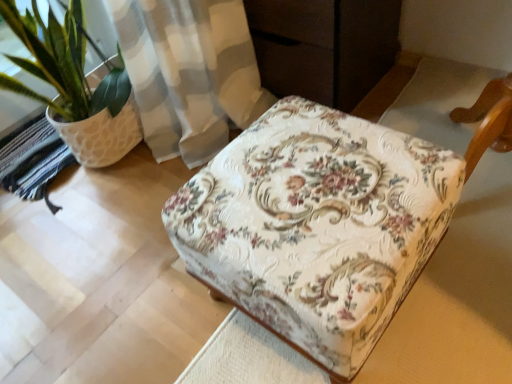
Question: Should I look upward or downward to see floral fabric ottoman at center?

Choices:
 (A) up
 (B) down

Answer: (B)

Question: Does floral fabric ottoman at center have a greater width compared to green leafy plant in textured pot at left?

Choices:
 (A) no
 (B) yes

Answer: (B)

Question: Is floral fabric ottoman at center to the right of green leafy plant in textured pot at left from the viewer's perspective?

Choices:
 (A) yes
 (B) no

Answer: (A)

Question: Can you confirm if floral fabric ottoman at center is shorter than green leafy plant in textured pot at left?

Choices:
 (A) no
 (B) yes

Answer: (B)

Question: Considering the relative sizes of floral fabric ottoman at center and green leafy plant in textured pot at left in the image provided, is floral fabric ottoman at center bigger than green leafy plant in textured pot at left?

Choices:
 (A) no
 (B) yes

Answer: (A)

Question: Is floral fabric ottoman at center to the left of green leafy plant in textured pot at left from the viewer's perspective?

Choices:
 (A) yes
 (B) no

Answer: (B)

Question: Is floral fabric ottoman at center placed right next to green leafy plant in textured pot at left?

Choices:
 (A) yes
 (B) no

Answer: (B)

Question: Does green leafy plant in textured pot at left come behind floral fabric ottoman at center?

Choices:
 (A) yes
 (B) no

Answer: (A)

Question: Is green leafy plant in textured pot at left facing away from floral fabric ottoman at center?

Choices:
 (A) yes
 (B) no

Answer: (B)

Question: From the image's perspective, does green leafy plant in textured pot at left appear lower than floral fabric ottoman at center?

Choices:
 (A) no
 (B) yes

Answer: (A)

Question: Can you confirm if green leafy plant in textured pot at left is smaller than floral fabric ottoman at center?

Choices:
 (A) no
 (B) yes

Answer: (A)

Question: Is green leafy plant in textured pot at left to the right of floral fabric ottoman at center from the viewer's perspective?

Choices:
 (A) yes
 (B) no

Answer: (B)

Question: Is green leafy plant in textured pot at left wider than floral fabric ottoman at center?

Choices:
 (A) no
 (B) yes

Answer: (A)

Question: From the image's perspective, is green leafy plant in textured pot at left located above or below floral fabric ottoman at center?

Choices:
 (A) below
 (B) above

Answer: (B)